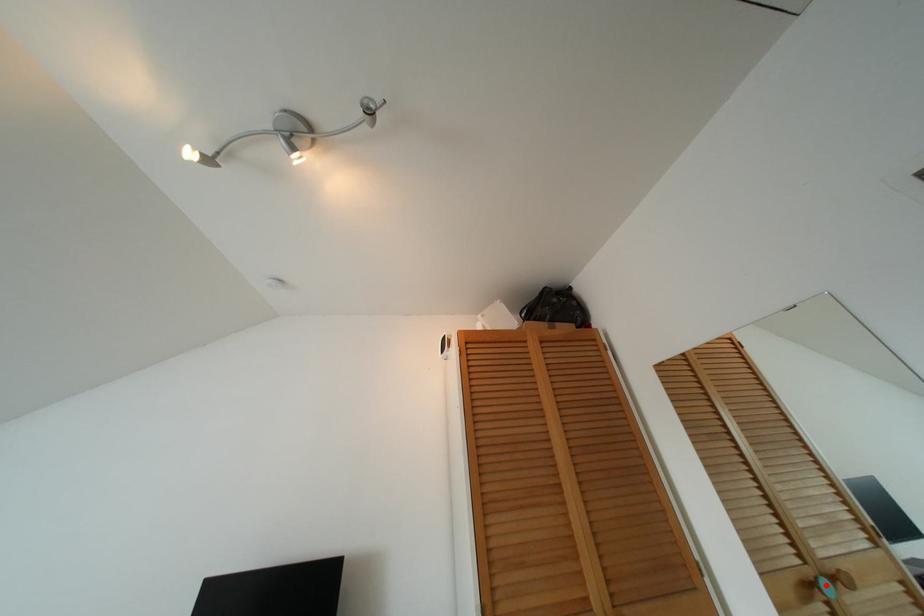
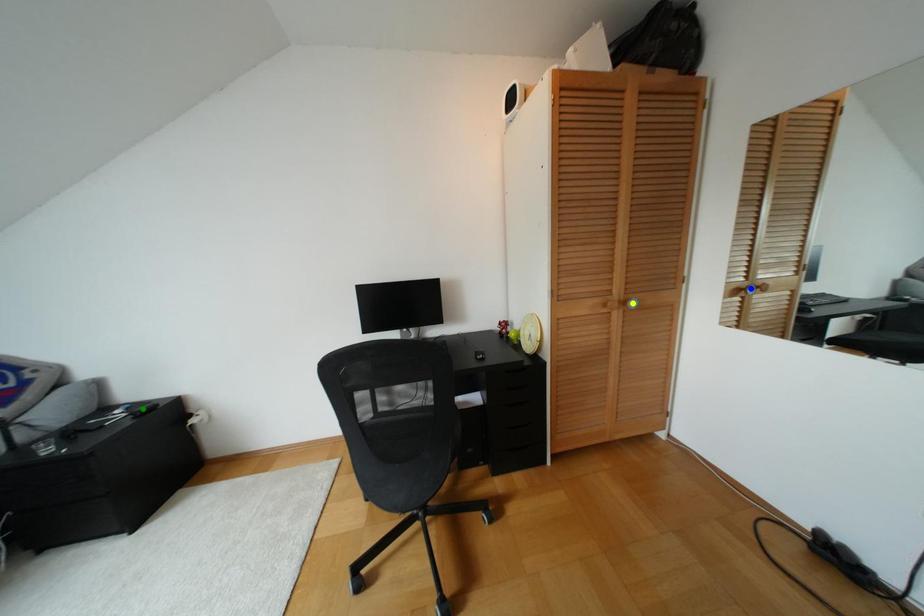
Question: I am providing you with two images of the same scene from different viewpoints. A red point is marked on the first image. You are given multiple points on the second image. Which mark in image 2 goes with the point in image 1?

Choices:
 (A) yellow point
 (B) blue point
 (C) green point

Answer: (B)